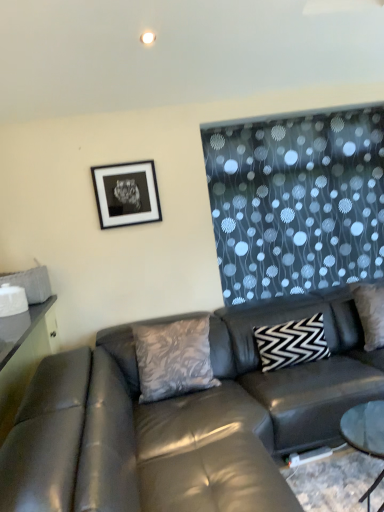
Question: Does matte black swivel chair at left touch silky gray pillow at center, which ranks as the first pillow in left-to-right order?

Choices:
 (A) yes
 (B) no

Answer: (B)

Question: Is matte black swivel chair at left further to camera compared to silky gray pillow at center, positioned as the 2th pillow in right-to-left order?

Choices:
 (A) no
 (B) yes

Answer: (A)

Question: From a real-world perspective, is matte black swivel chair at left located higher than silky gray pillow at center, which ranks as the first pillow in left-to-right order?

Choices:
 (A) yes
 (B) no

Answer: (B)

Question: Is matte black swivel chair at left shorter than silky gray pillow at center, positioned as the 2th pillow in right-to-left order?

Choices:
 (A) yes
 (B) no

Answer: (B)

Question: Is matte black swivel chair at left aimed at silky gray pillow at center, which ranks as the first pillow in left-to-right order?

Choices:
 (A) no
 (B) yes

Answer: (A)

Question: Are matte black swivel chair at left and silky gray pillow at center, positioned as the 2th pillow in right-to-left order, far apart?

Choices:
 (A) yes
 (B) no

Answer: (B)

Question: From the image's perspective, is black matte picture frame at upper left beneath silky gray pillow at center, which ranks as the first pillow in left-to-right order?

Choices:
 (A) no
 (B) yes

Answer: (A)

Question: From a real-world perspective, is black matte picture frame at upper left on top of silky gray pillow at center, which ranks as the first pillow in left-to-right order?

Choices:
 (A) no
 (B) yes

Answer: (B)

Question: Are black matte picture frame at upper left and silky gray pillow at center, positioned as the 2th pillow in right-to-left order, beside each other?

Choices:
 (A) no
 (B) yes

Answer: (A)

Question: Considering the relative sizes of black matte picture frame at upper left and silky gray pillow at center, which ranks as the first pillow in left-to-right order, in the image provided, is black matte picture frame at upper left wider than silky gray pillow at center, which ranks as the first pillow in left-to-right order,?

Choices:
 (A) no
 (B) yes

Answer: (A)

Question: Does black matte picture frame at upper left appear on the left side of silky gray pillow at center, which ranks as the first pillow in left-to-right order?

Choices:
 (A) yes
 (B) no

Answer: (A)

Question: Does black matte picture frame at upper left come in front of silky gray pillow at center, positioned as the 2th pillow in right-to-left order?

Choices:
 (A) yes
 (B) no

Answer: (B)

Question: Are black matte picture frame at upper left and leather couch at center beside each other?

Choices:
 (A) yes
 (B) no

Answer: (B)